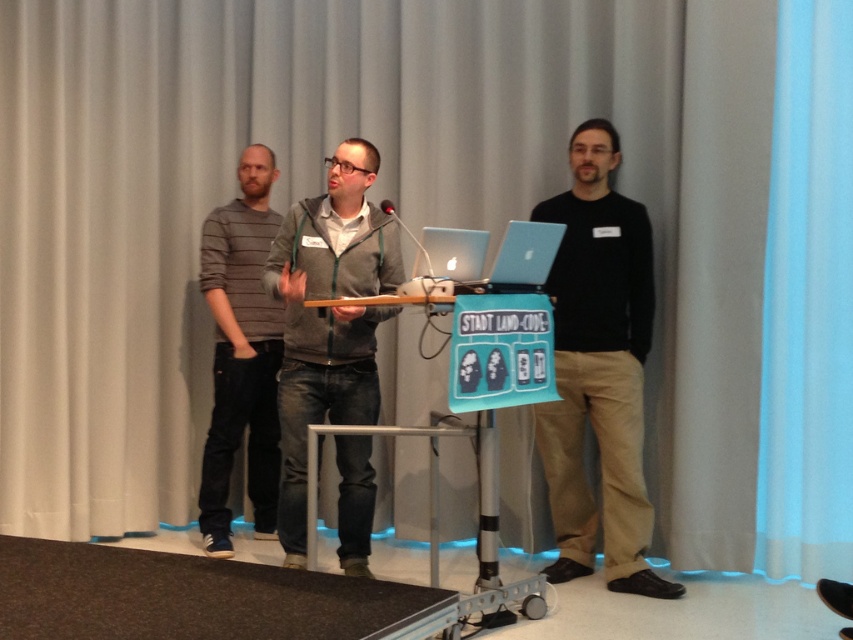
Question: Can you confirm if jeans at center is thinner than silver metallic laptop at center?

Choices:
 (A) no
 (B) yes

Answer: (A)

Question: Does striped sweater at left appear under sleek silver laptop at center?

Choices:
 (A) yes
 (B) no

Answer: (A)

Question: Which of the following is the farthest from the observer?

Choices:
 (A) striped sweater at left
 (B) silver metallic laptop at center
 (C) jeans at center

Answer: (A)

Question: Based on their relative distances, which object is nearer to the jeans at center?

Choices:
 (A) black matte shirt at right
 (B) silver metallic laptop at center
 (C) sleek silver laptop at center

Answer: (C)

Question: Which point is farther to the camera?

Choices:
 (A) (260, 160)
 (B) (621, 432)
 (C) (521, 253)
 (D) (378, 289)

Answer: (A)

Question: From the image, what is the correct spatial relationship of striped sweater at left in relation to silver metallic laptop at center?

Choices:
 (A) below
 (B) above

Answer: (A)